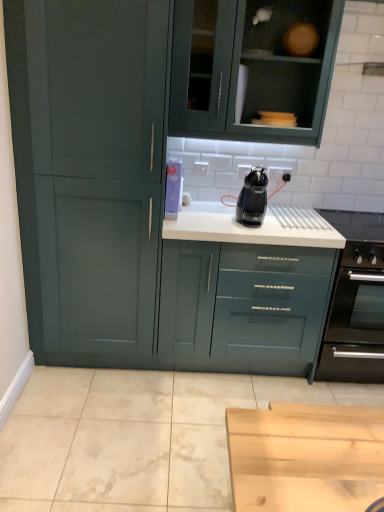
I want to click on matte green cabinet at upper center, so click(252, 68).

Measure the distance between black matte oven at right and camera.

black matte oven at right is 7.21 feet away from camera.

The width and height of the screenshot is (384, 512). What are the coordinates of `black plastic coffee machine at center` in the screenshot? It's located at (253, 198).

Considering the sizes of objects black plastic coffee machine at center and matte green cupboard at left in the image provided, who is shorter, black plastic coffee machine at center or matte green cupboard at left?

black plastic coffee machine at center.

How many degrees apart are the facing directions of black plastic coffee machine at center and matte green cupboard at left?

The angular difference between black plastic coffee machine at center and matte green cupboard at left is 4.86 degrees.

From the image's perspective, relative to matte green cupboard at left, is black plastic coffee machine at center above or below?

black plastic coffee machine at center is situated lower than matte green cupboard at left in the image.

Consider the image. Between black plastic coffee machine at center and matte green cupboard at left, which one has smaller size?

With smaller size is black plastic coffee machine at center.

Which object is positioned more to the left, matte green cupboard at left or black matte oven at right?

Positioned to the left is matte green cupboard at left.

Where is `home appliance below the matte green cupboard at left (from the image's perspective)`? home appliance below the matte green cupboard at left (from the image's perspective) is located at coordinates (355, 303).

Which of these two, matte green cupboard at left or black matte oven at right, stands taller?

Standing taller between the two is matte green cupboard at left.

Considering the relative sizes of black matte oven at right and matte green cabinet at upper center in the image provided, is black matte oven at right smaller than matte green cabinet at upper center?

Actually, black matte oven at right might be larger than matte green cabinet at upper center.

From a real-world perspective, is black matte oven at right positioned over matte green cabinet at upper center based on gravity?

No, from a real-world perspective, black matte oven at right is not above matte green cabinet at upper center.

Is black matte oven at right with matte green cabinet at upper center?

No, black matte oven at right is not making contact with matte green cabinet at upper center.

Consider the image. Is black matte oven at right positioned with its back to matte green cabinet at upper center?

That's not correct — black matte oven at right is not looking away from matte green cabinet at upper center.

Can you confirm if matte green cabinet at upper center is wider than black plastic coffee machine at center?

Correct, the width of matte green cabinet at upper center exceeds that of black plastic coffee machine at center.

From the image's perspective, which one is positioned higher, matte green cabinet at upper center or black plastic coffee machine at center?

matte green cabinet at upper center appears higher in the image.

Is matte green cabinet at upper center positioned before black plastic coffee machine at center?

Yes.

Does matte green cabinet at upper center turn towards black plastic coffee machine at center?

No, matte green cabinet at upper center is not oriented towards black plastic coffee machine at center.

From the image's perspective, is black matte oven at right located above or below matte green cupboard at left?

black matte oven at right is situated lower than matte green cupboard at left in the image.

Find the location of a particular element. The height and width of the screenshot is (512, 384). cupboard on the left of the black matte oven at right is located at coordinates (88, 172).

Based on the photo, which point is more distant from viewer, (338, 216) or (67, 343)?

Positioned behind is point (338, 216).

Which is more to the left, black matte oven at right or matte green cupboard at left?

matte green cupboard at left.

Is matte green cabinet at upper center positioned with its back to matte green cupboard at left?

No, matte green cabinet at upper center's orientation is not away from matte green cupboard at left.

Visually, is matte green cabinet at upper center positioned to the left or to the right of matte green cupboard at left?

A: Based on their positions, matte green cabinet at upper center is located to the right of matte green cupboard at left.

Is point (224, 36) closer to viewer compared to point (90, 114)?

No, (224, 36) is further to viewer.

Consider the image. From a real-world perspective, which object rests below the other?

black matte oven at right, from a real-world perspective.

Is black matte oven at right placed right next to black plastic coffee machine at center?

No, black matte oven at right is not touching black plastic coffee machine at center.

Can you confirm if black matte oven at right is taller than black plastic coffee machine at center?

Indeed, black matte oven at right has a greater height compared to black plastic coffee machine at center.

In the scene shown: Which of these two, black matte oven at right or black plastic coffee machine at center, is wider?

With larger width is black matte oven at right.

Where is `cupboard above the black plastic coffee machine at center (from the image's perspective)`? The width and height of the screenshot is (384, 512). cupboard above the black plastic coffee machine at center (from the image's perspective) is located at coordinates (88, 172).

Locate an element on the screen. The width and height of the screenshot is (384, 512). home appliance located underneath the matte green cupboard at left (from a real-world perspective) is located at coordinates (355, 303).

Looking at the image, which one is located closer to black matte oven at right, matte green cabinet at upper center or black plastic coffee machine at center?

black plastic coffee machine at center is closer to black matte oven at right.

Looking at the image, which one is located further to black matte oven at right, matte green cupboard at left or black plastic coffee machine at center?

matte green cupboard at left.

Based on their spatial positions, is matte green cabinet at upper center or black matte oven at right further from black plastic coffee machine at center?

black matte oven at right lies further to black plastic coffee machine at center than the other object.

Based on their spatial positions, is black plastic coffee machine at center or matte green cupboard at left further from matte green cabinet at upper center?

Based on the image, matte green cupboard at left appears to be further to matte green cabinet at upper center.

Considering their positions, is black matte oven at right positioned closer to matte green cabinet at upper center than matte green cupboard at left?

Among the two, matte green cupboard at left is located nearer to matte green cabinet at upper center.

From the image, which object appears to be farther from black plastic coffee machine at center, matte green cabinet at upper center or matte green cupboard at left?

Based on the image, matte green cupboard at left appears to be further to black plastic coffee machine at center.

Which object lies further to the anchor point black matte oven at right, black plastic coffee machine at center or matte green cupboard at left?

matte green cupboard at left is further to black matte oven at right.

In the scene shown: Looking at the image, which one is located closer to matte green cupboard at left, black matte oven at right or matte green cabinet at upper center?

Result: Among the two, matte green cabinet at upper center is located nearer to matte green cupboard at left.

Locate an element on the screen. This screenshot has height=512, width=384. kitchen appliance that lies between matte green cabinet at upper center and black matte oven at right from top to bottom is located at coordinates (253, 198).

Locate an element on the screen. This screenshot has height=512, width=384. cabinetry situated between matte green cupboard at left and black matte oven at right from left to right is located at coordinates (252, 68).

The width and height of the screenshot is (384, 512). Find the location of `kitchen appliance between matte green cupboard at left and black matte oven at right in the horizontal direction`. kitchen appliance between matte green cupboard at left and black matte oven at right in the horizontal direction is located at coordinates (253, 198).

The width and height of the screenshot is (384, 512). I want to click on cabinetry between matte green cupboard at left and black plastic coffee machine at center, so click(x=252, y=68).